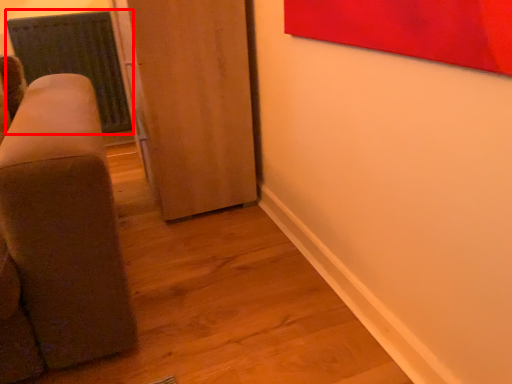
Question: Observing the image, what is the correct spatial positioning of radiator (annotated by the red box) in reference to door?

Choices:
 (A) right
 (B) left

Answer: (B)